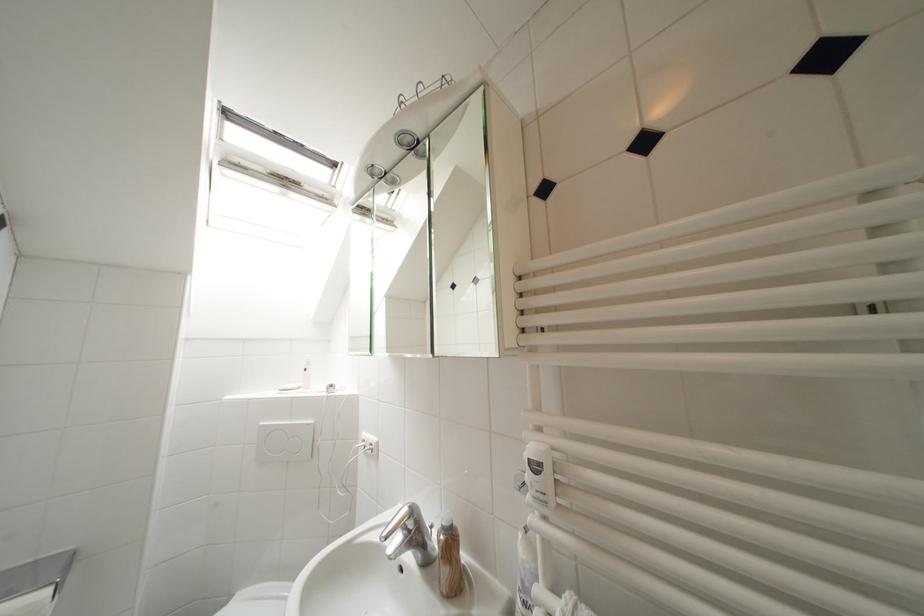
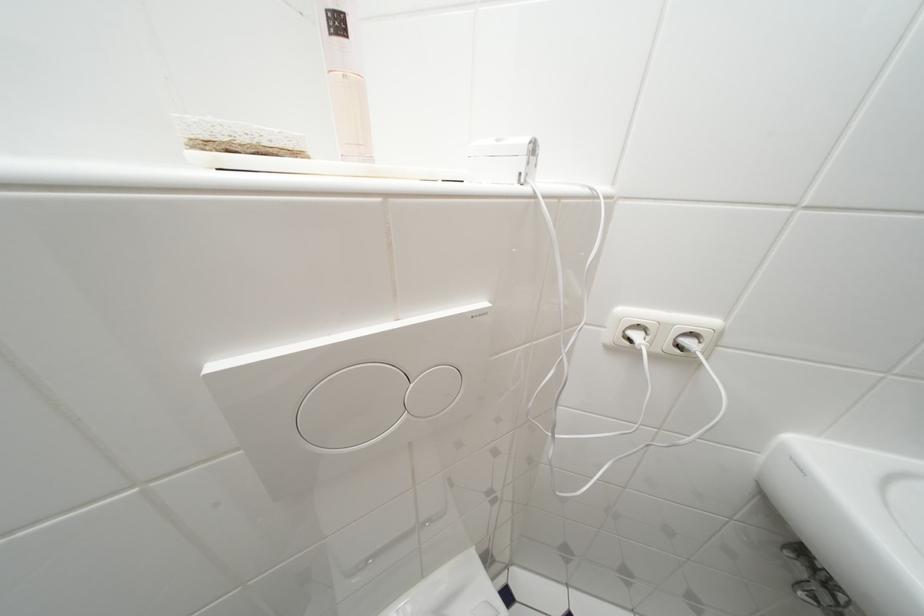
Locate, in the second image, the point that corresponds to pixel 311 373 in the first image.

(345, 26)